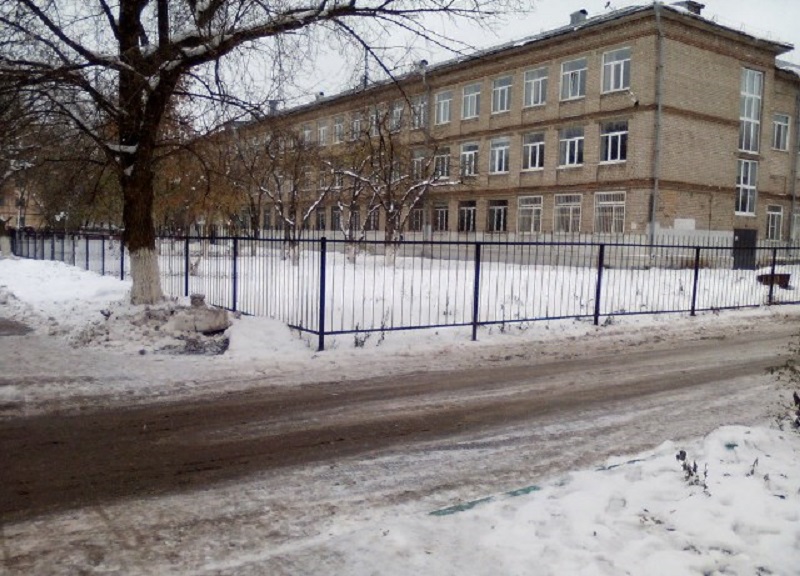
You are a GUI agent. You are given a task and a screenshot of the screen. Output one action in this format:
    pyautogui.click(x=<x>, y=<y>)
    Task: Click on the black door
    The image size is (800, 576).
    Given the screenshot: What is the action you would take?
    pyautogui.click(x=746, y=238)